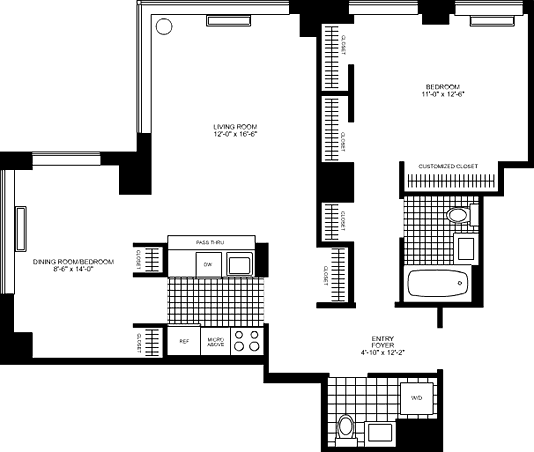
This screenshot has height=452, width=534. Identify the location of tiled area. (206, 300), (431, 225), (362, 399).